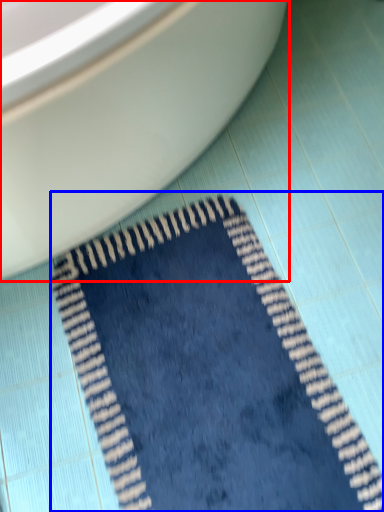
Question: Among these objects, which one is farthest to the camera, toilet (highlighted by a red box) or doormat (highlighted by a blue box)?

Choices:
 (A) toilet
 (B) doormat

Answer: (B)